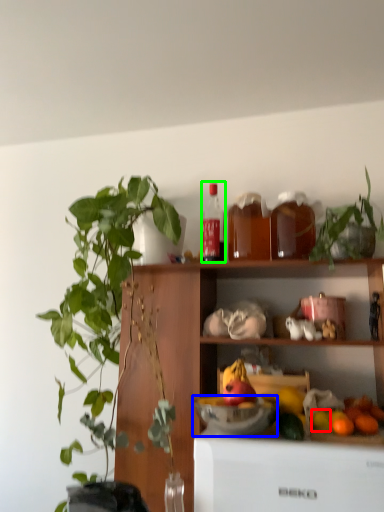
Question: Which is nearer to the fruit (highlighted by a red box)? bowl (highlighted by a blue box) or bottle (highlighted by a green box).

Choices:
 (A) bowl
 (B) bottle

Answer: (A)